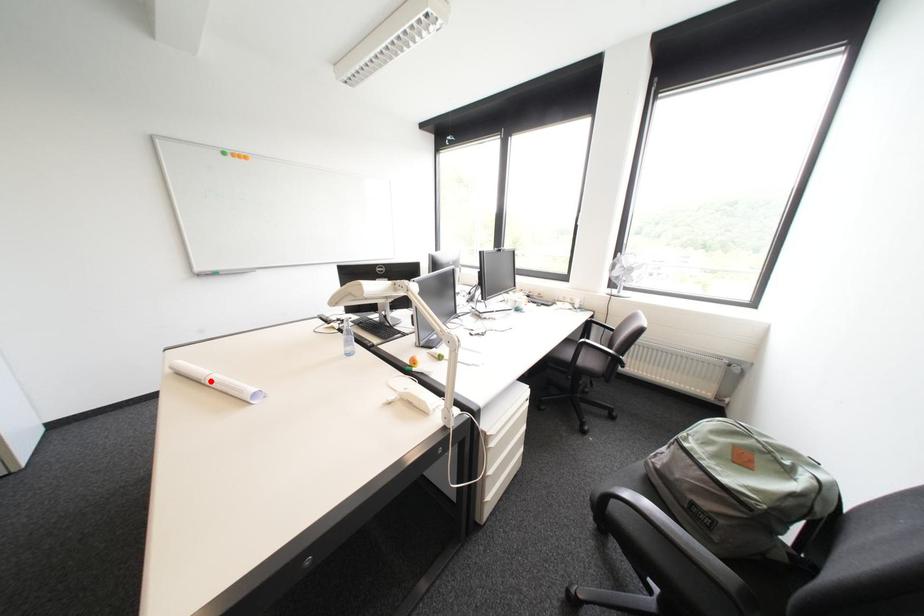
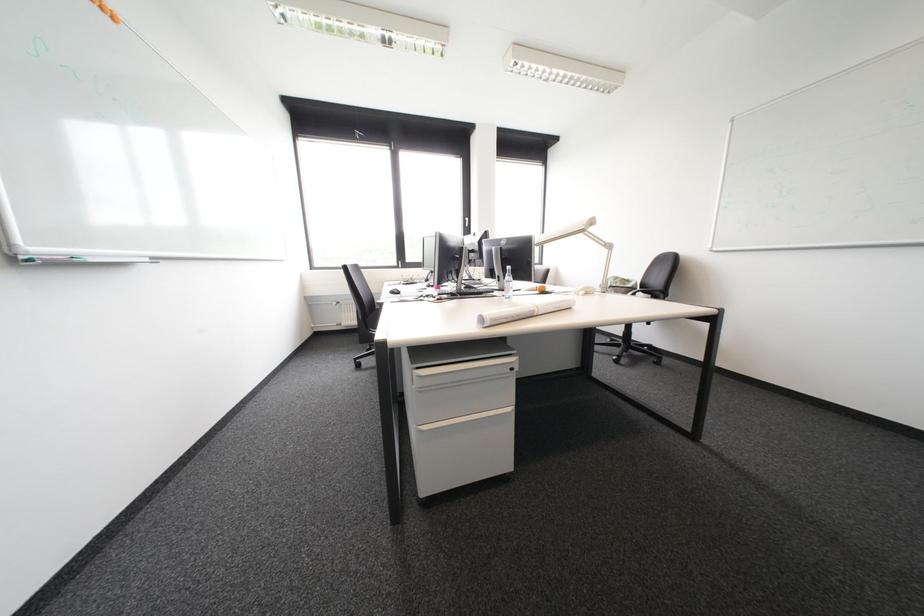
Find the pixel in the second image that matches the highlighted location in the first image.

(543, 312)